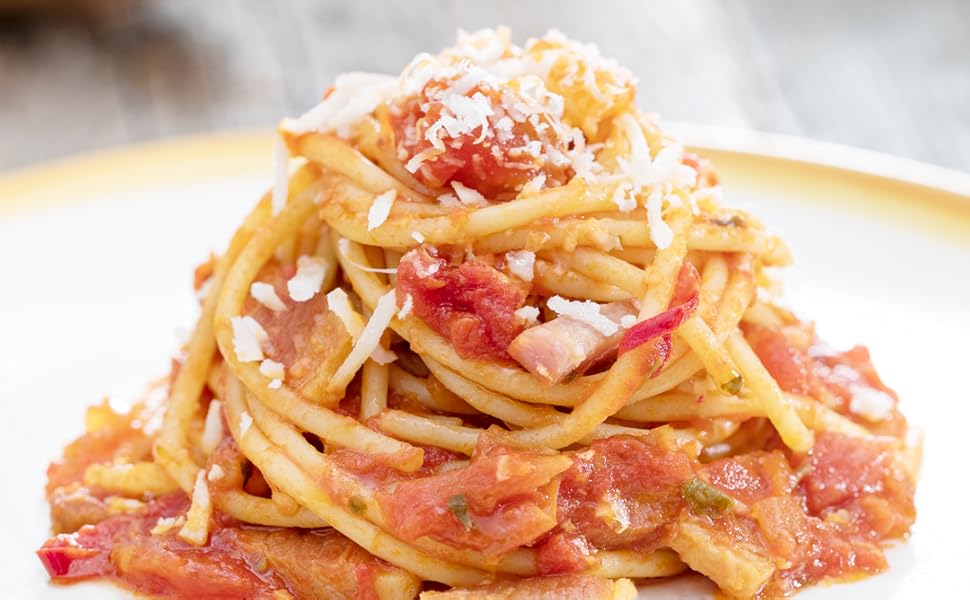
The image size is (970, 600). Find the location of `yellow rim of plate`. yellow rim of plate is located at coordinates (170, 164).